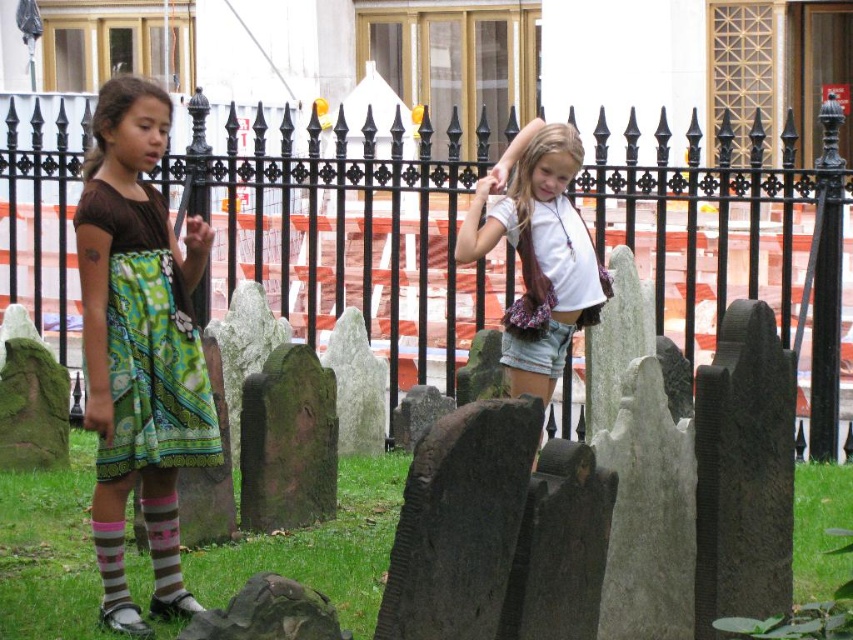
Between white cotton shirt at center and striped cotton socks at lower left, which one has more height?

Standing taller between the two is white cotton shirt at center.

Between white cotton shirt at center and striped cotton socks at lower left, which one is positioned lower?

Positioned lower is striped cotton socks at lower left.

Which is in front, point (543, 392) or point (155, 509)?

Point (155, 509) is in front.

Find the location of `white cotton shirt at center`. white cotton shirt at center is located at coordinates tap(538, 253).

Can you confirm if black wrought iron fence at upper center is smaller than striped cotton socks at lower left?

Actually, black wrought iron fence at upper center might be larger than striped cotton socks at lower left.

What do you see at coordinates (334, 216) in the screenshot? I see `black wrought iron fence at upper center` at bounding box center [334, 216].

Where is `black wrought iron fence at upper center`? The image size is (853, 640). black wrought iron fence at upper center is located at coordinates (334, 216).

Which is behind, point (524, 312) or point (117, 609)?

The point (524, 312) is more distant.

Does white cotton shirt at center have a smaller size compared to striped cotton sock at lower left?

Actually, white cotton shirt at center might be larger than striped cotton sock at lower left.

Where is `white cotton shirt at center`? Image resolution: width=853 pixels, height=640 pixels. white cotton shirt at center is located at coordinates (538, 253).